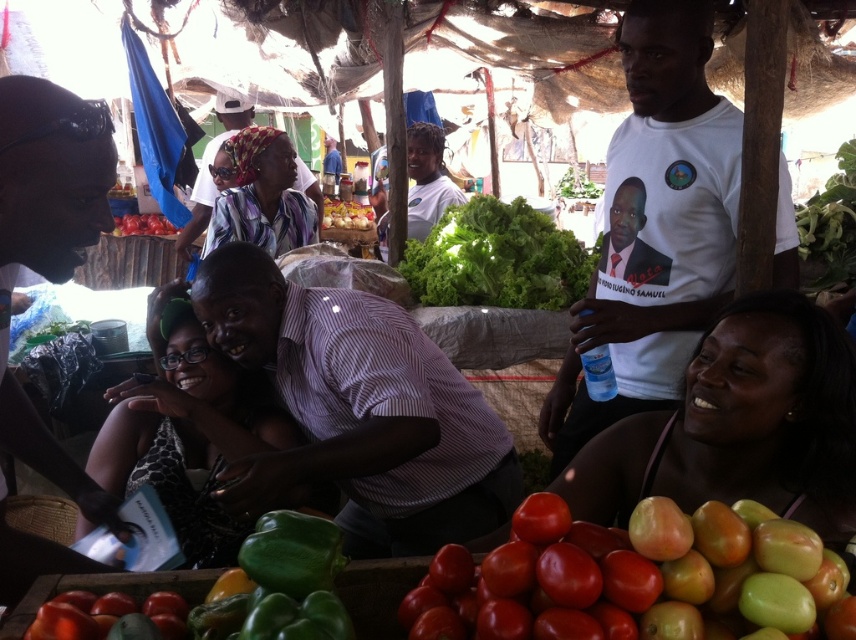
Is matte black shirt at left bigger than green matte tomatoes at lower right?

Answer: Indeed, matte black shirt at left has a larger size compared to green matte tomatoes at lower right.

Does point (31, 230) come behind point (836, 579)?

Yes.

Identify the location of matte black shirt at left. (49, 248).

Is white printed t-shirt at upper right taller than green matte tomatoes at lower right?

Correct, white printed t-shirt at upper right is much taller as green matte tomatoes at lower right.

Looking at this image, is white printed t-shirt at upper right bigger than green matte tomatoes at lower right?

Correct, white printed t-shirt at upper right is larger in size than green matte tomatoes at lower right.

This screenshot has height=640, width=856. Identify the location of white printed t-shirt at upper right. (654, 227).

I want to click on white printed t-shirt at upper right, so click(654, 227).

Measure the distance between smooth skin woman at lower right and camera.

34.46 inches

Does smooth skin woman at lower right have a lesser width compared to shiny red tomato at lower center?

In fact, smooth skin woman at lower right might be wider than shiny red tomato at lower center.

Looking at this image, measure the distance between point (637, 486) and camera.

Point (637, 486) and camera are 4.16 feet apart.

I want to click on smooth skin woman at lower right, so click(x=740, y=426).